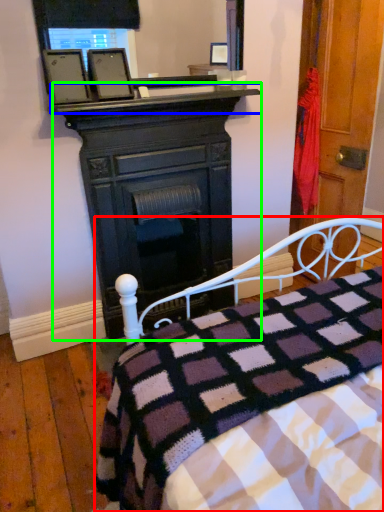
Question: Which object is the closest to the bed (highlighted by a red box)? Choose among these: mantle (highlighted by a blue box) or desk (highlighted by a green box).

Choices:
 (A) mantle
 (B) desk

Answer: (B)